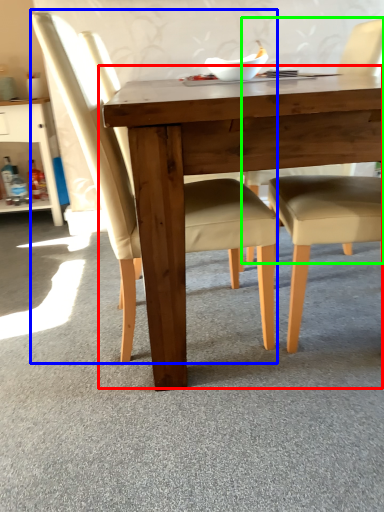
Question: Which object is the closest to the table (highlighted by a red box)? Choose among these: chair (highlighted by a blue box) or chair (highlighted by a green box).

Choices:
 (A) chair
 (B) chair

Answer: (A)